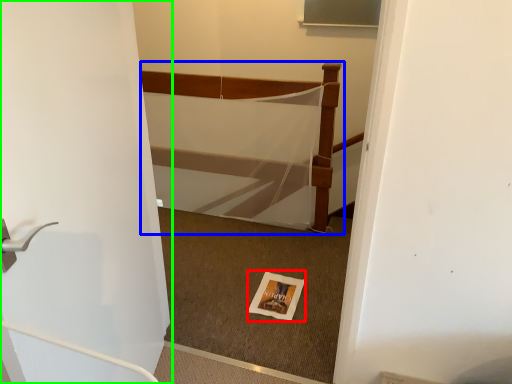
Question: Which object is positioned farthest from postcard (highlighted by a red box)? Select from bed (highlighted by a blue box) and door (highlighted by a green box).

Choices:
 (A) bed
 (B) door

Answer: (B)